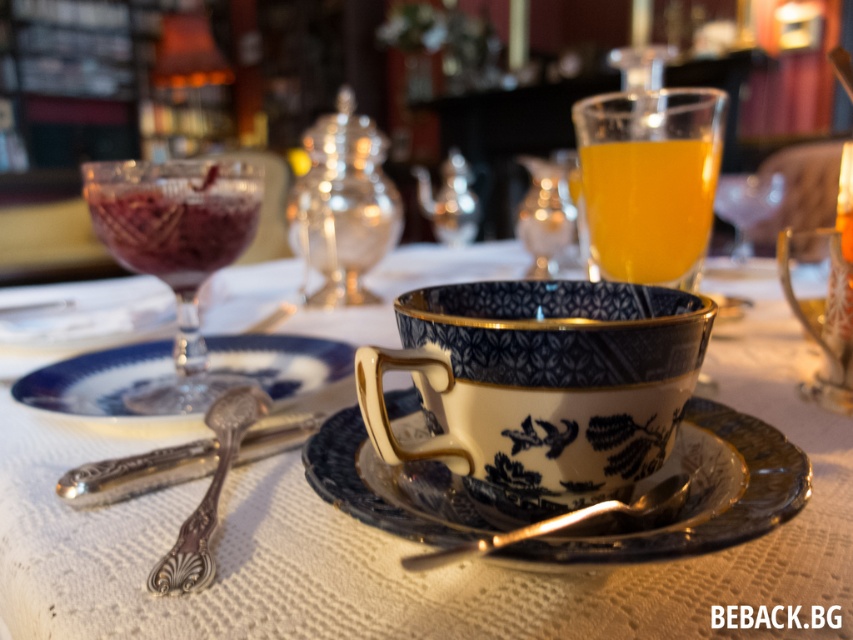
Does blue porcelain saucer at center have a lesser height compared to polished silver spoon at center?

Yes, blue porcelain saucer at center is shorter than polished silver spoon at center.

Which is in front, point (164, 344) or point (213, 417)?

Point (213, 417)

This screenshot has height=640, width=853. I want to click on blue porcelain saucer at center, so click(181, 376).

Can you confirm if white porcelain cup at center is thinner than polished silver spoon at center?

Incorrect, white porcelain cup at center's width is not less than polished silver spoon at center's.

Between white porcelain cup at center and polished silver spoon at center, which one appears on the left side from the viewer's perspective?

Positioned to the left is polished silver spoon at center.

Where is `white porcelain cup at center`? white porcelain cup at center is located at coordinates (405, 541).

Is translucent glass at upper right to the right of gold metallic spoon at center from the viewer's perspective?

Indeed, translucent glass at upper right is positioned on the right side of gold metallic spoon at center.

From the picture: Measure the distance between point (653, 259) and camera.

A distance of 49.28 centimeters exists between point (653, 259) and camera.

This screenshot has width=853, height=640. I want to click on translucent glass at upper right, so click(x=648, y=209).